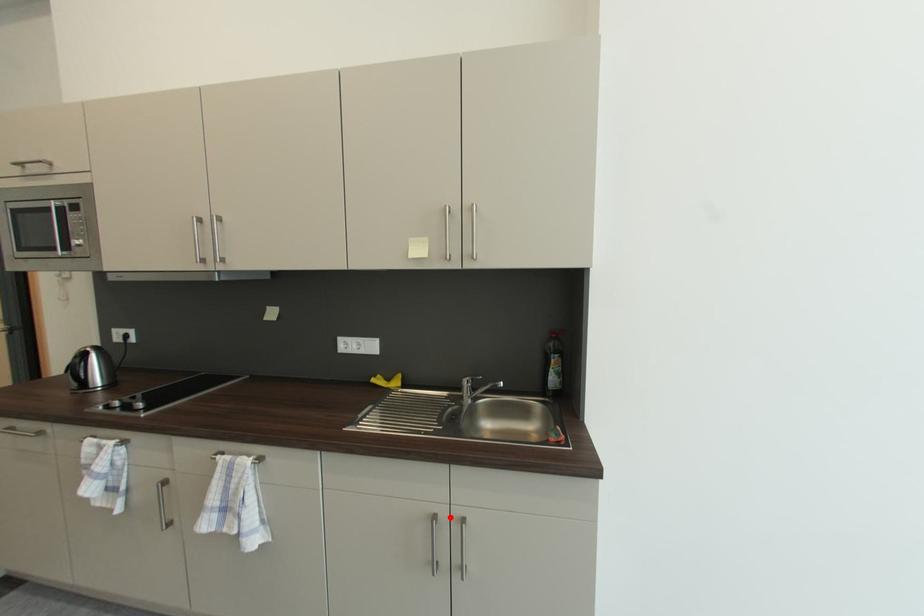
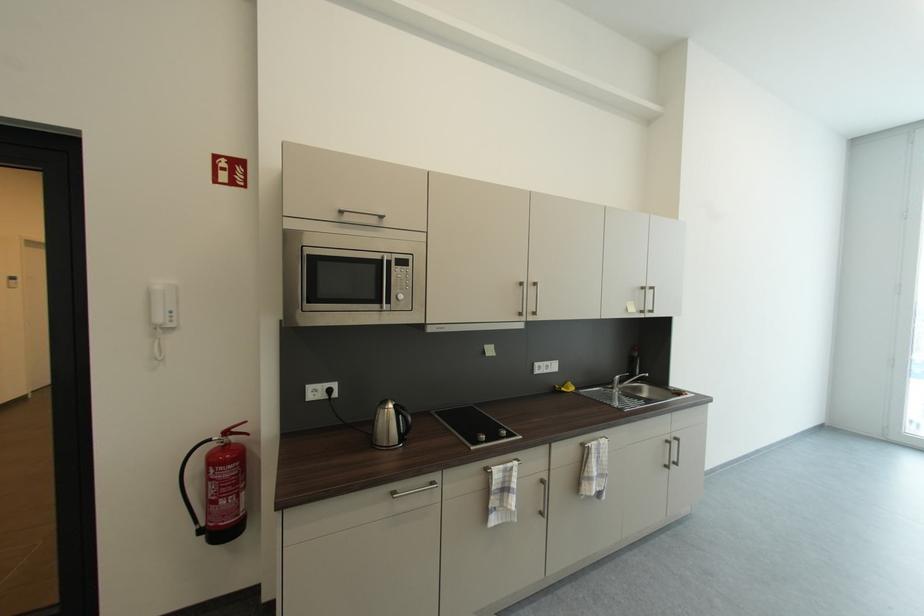
Locate, in the second image, the point that corresponds to the highlighted location in the first image.

(675, 440)